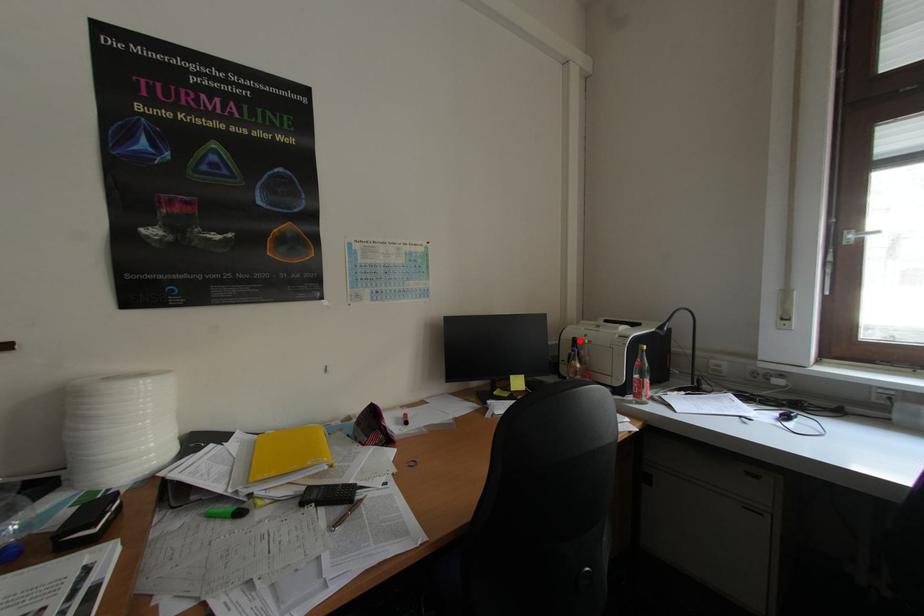
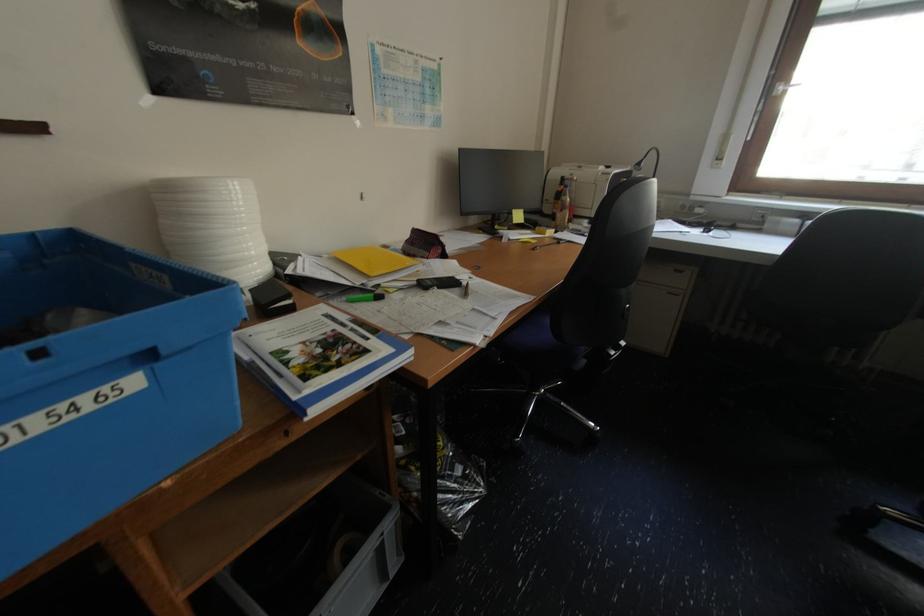
In the second image, find the point that corresponds to the highlighted location in the first image.

(568, 180)